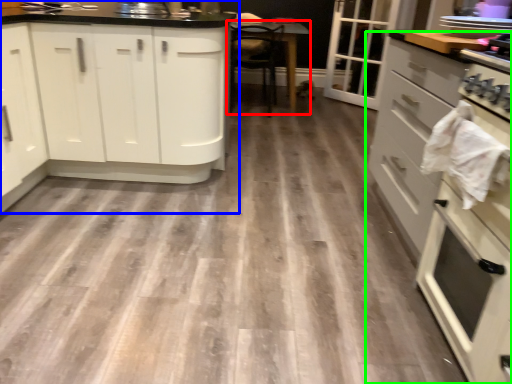
Question: Which object is the farthest from table (highlighted by a red box)? Choose among these: cabinetry (highlighted by a blue box) or cabinetry (highlighted by a green box).

Choices:
 (A) cabinetry
 (B) cabinetry

Answer: (B)